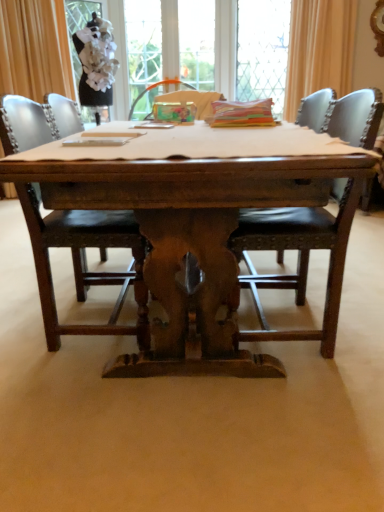
Question: Is smooth wooden table at center further to camera compared to white fabric screen door at upper left?

Choices:
 (A) yes
 (B) no

Answer: (B)

Question: Is smooth wooden table at center bigger than white fabric screen door at upper left?

Choices:
 (A) no
 (B) yes

Answer: (A)

Question: Considering the relative sizes of smooth wooden table at center and white fabric screen door at upper left in the image provided, is smooth wooden table at center shorter than white fabric screen door at upper left?

Choices:
 (A) yes
 (B) no

Answer: (A)

Question: Is smooth wooden table at center thinner than white fabric screen door at upper left?

Choices:
 (A) yes
 (B) no

Answer: (B)

Question: Can you confirm if smooth wooden table at center is taller than white fabric screen door at upper left?

Choices:
 (A) yes
 (B) no

Answer: (B)

Question: Would you say matte gold curtain at upper left, positioned as the 1th curtain in left-to-right order, is to the left or to the right of leather cushioned chair at right, the 2th chair in the left-to-right sequence, in the picture?

Choices:
 (A) right
 (B) left

Answer: (B)

Question: Looking at the image, does matte gold curtain at upper left, which ranks as the second curtain in right-to-left order, seem bigger or smaller compared to leather cushioned chair at right, the 2th chair in the left-to-right sequence?

Choices:
 (A) big
 (B) small

Answer: (A)

Question: In terms of width, does matte gold curtain at upper left, which ranks as the second curtain in right-to-left order, look wider or thinner when compared to leather cushioned chair at right, the 2th chair in the left-to-right sequence?

Choices:
 (A) wide
 (B) thin

Answer: (B)

Question: In the image, is matte gold curtain at upper left, which ranks as the second curtain in right-to-left order, positioned in front of or behind leather cushioned chair at right, which appears as the 1th chair when viewed from the right?

Choices:
 (A) behind
 (B) front

Answer: (A)

Question: Relative to wooden table at center, is white fabric screen door at upper left in front or behind?

Choices:
 (A) behind
 (B) front

Answer: (A)

Question: In terms of size, does white fabric screen door at upper left appear bigger or smaller than wooden table at center?

Choices:
 (A) small
 (B) big

Answer: (A)

Question: Is white fabric screen door at upper left to the left or to the right of wooden table at center in the image?

Choices:
 (A) right
 (B) left

Answer: (B)

Question: From a real-world perspective, relative to wooden table at center, is white fabric screen door at upper left vertically above or below?

Choices:
 (A) below
 (B) above

Answer: (B)

Question: Is dark brown wood chair at center, which is counted as the 2th chair, starting from the right, inside or outside of leather cushioned chair at right, which appears as the 1th chair when viewed from the right?

Choices:
 (A) inside
 (B) outside

Answer: (B)

Question: Is dark brown wood chair at center, which is counted as the 2th chair, starting from the right, taller or shorter than leather cushioned chair at right, the 2th chair in the left-to-right sequence?

Choices:
 (A) short
 (B) tall

Answer: (B)